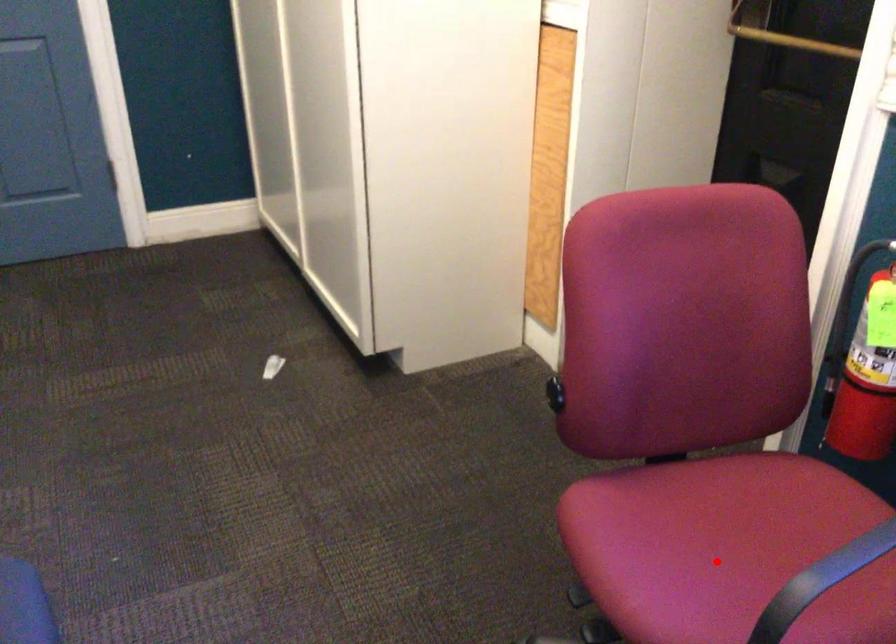
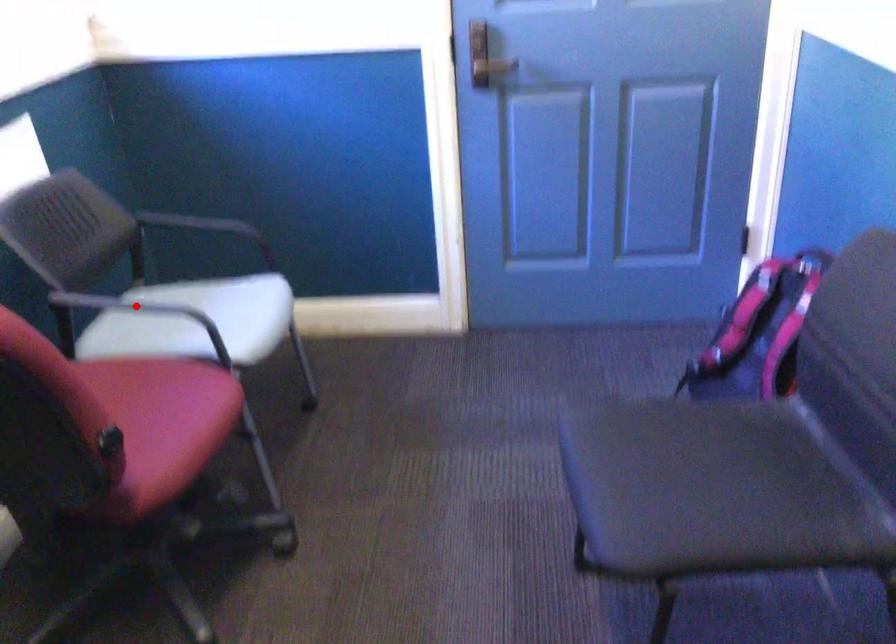
I am providing you with two images of the same scene from different viewpoints. A red point is marked on the first image and another point is marked on the second image. Do the highlighted points in image1 and image2 indicate the same real-world spot?

No